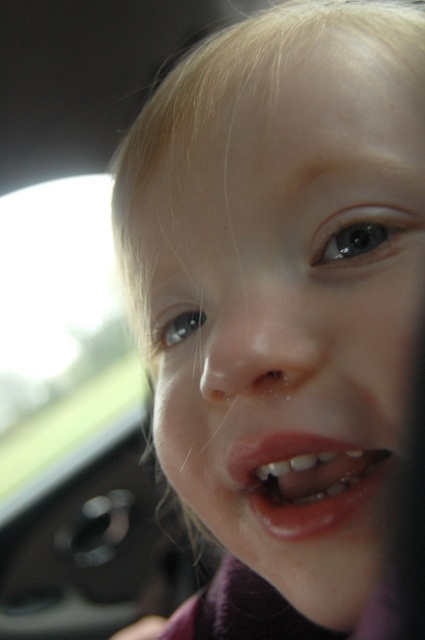
Based on the photo, you are a photographer trying to capture a portrait of a child. You notice the smooth skin face at center and the pink glossy lips at center. Which part of the child is closer to the camera lens?

The smooth skin face at center is closer to the camera lens because it is positioned in front of the pink glossy lips at center.

You are a photographer trying to capture a close portrait of a child. You notice the smooth skin face at center and the pink glossy lips at center. Which of these two features is bigger in the photo?

The smooth skin face at center is larger in size compared to the pink glossy lips at center in the photo.